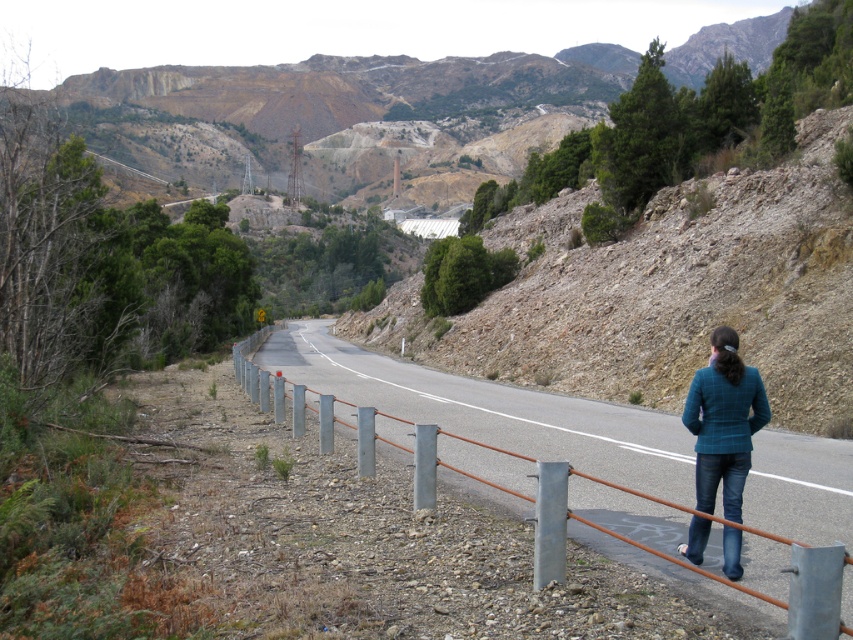
Who is more distant from viewer, (x=515, y=483) or (x=722, y=490)?

Point (x=515, y=483)

Consider the image. Is metal/smooth fence at center above teal plaid jacket at lower right?

No, metal/smooth fence at center is not above teal plaid jacket at lower right.

Is point (843, 528) behind point (693, 428)?

Yes, point (843, 528) is farther from viewer.

At what (x,y) coordinates should I click in order to perform the action: click on metal/smooth fence at center. Please return your answer as a coordinate pair (x, y). This screenshot has width=853, height=640. Looking at the image, I should click on (492, 412).